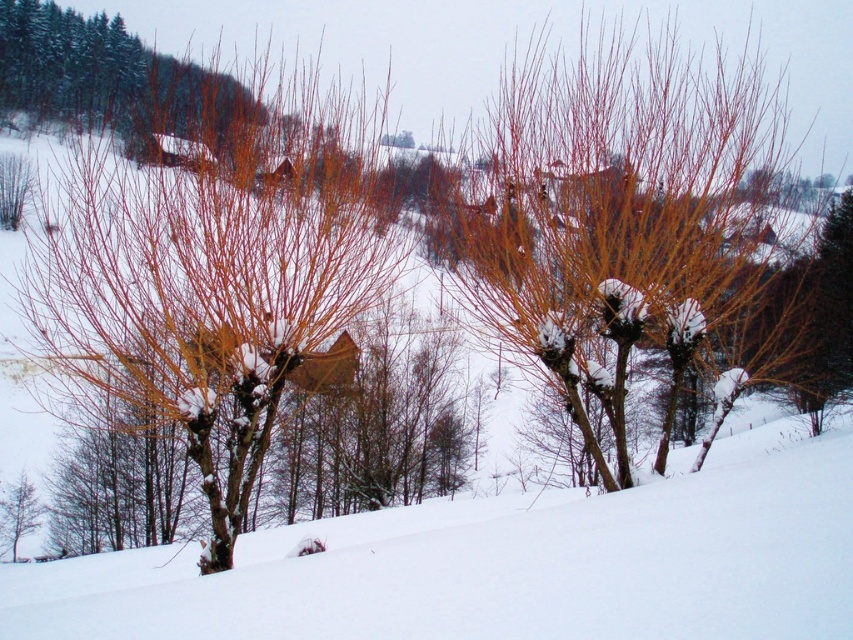
Question: Is smooth bark tree at center to the right of smooth orange branches at center from the viewer's perspective?

Choices:
 (A) yes
 (B) no

Answer: (A)

Question: Which object appears closest to the camera in this image?

Choices:
 (A) smooth orange branches at center
 (B) smooth bark tree at center

Answer: (A)

Question: Which of these objects is positioned closest to the smooth bark tree at center?

Choices:
 (A) green matte tree at lower left
 (B) smooth orange branches at center

Answer: (B)

Question: Can you confirm if smooth bark tree at center is positioned to the left of smooth orange branches at center?

Choices:
 (A) yes
 (B) no

Answer: (B)

Question: Which point appears closest to the camera in this image?

Choices:
 (A) (260, 176)
 (B) (543, 116)

Answer: (A)

Question: Is smooth bark tree at center thinner than green matte tree at lower left?

Choices:
 (A) yes
 (B) no

Answer: (B)